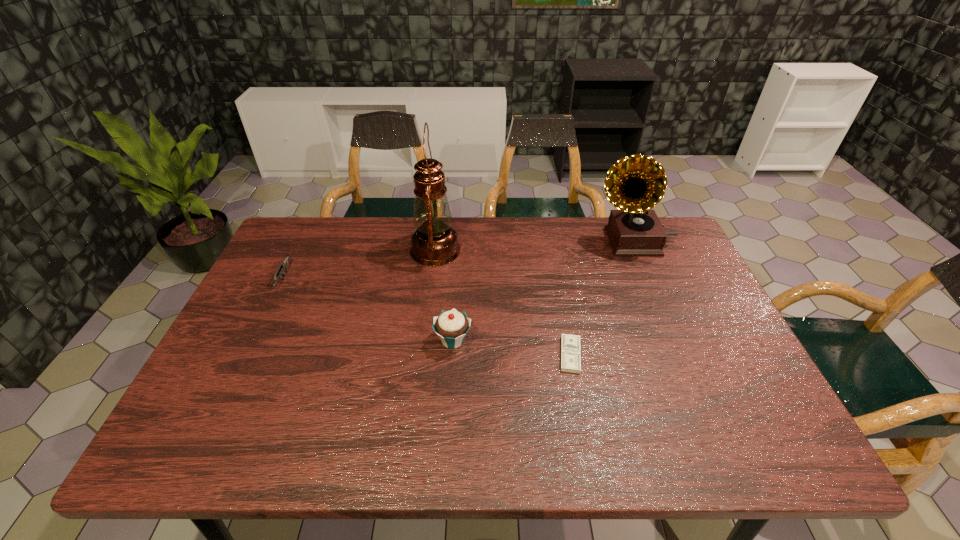
This screenshot has height=540, width=960. In the image, there is a desktop. What are the coordinates of `free region at the far edge` in the screenshot? It's located at (590, 238).

The height and width of the screenshot is (540, 960). In order to click on vacant space at the near edge of the desktop in this screenshot , I will do `click(670, 436)`.

At what (x,y) coordinates should I click in order to perform the action: click on free space at the left edge. Please return your answer as a coordinate pair (x, y). This screenshot has width=960, height=540. Looking at the image, I should click on (185, 413).

Image resolution: width=960 pixels, height=540 pixels. What are the coordinates of `free space at the right edge` in the screenshot? It's located at (733, 386).

In the image, there is a desktop. In order to click on vacant space at the far left corner in this screenshot , I will do (x=337, y=227).

Where is `free region at the far right corner of the desktop`? free region at the far right corner of the desktop is located at coordinates (671, 226).

Find the location of a particular element. vacant space at the near right corner is located at coordinates (767, 448).

This screenshot has width=960, height=540. What are the coordinates of `vacant region between the rightmost object and the fourth object from left to right` in the screenshot? It's located at (602, 298).

Find the location of `empty location between the rightmost object and the fourth tallest object`. empty location between the rightmost object and the fourth tallest object is located at coordinates (458, 260).

Locate an element on the screen. The image size is (960, 540). empty location between the second object from right to left and the third shortest object is located at coordinates (512, 348).